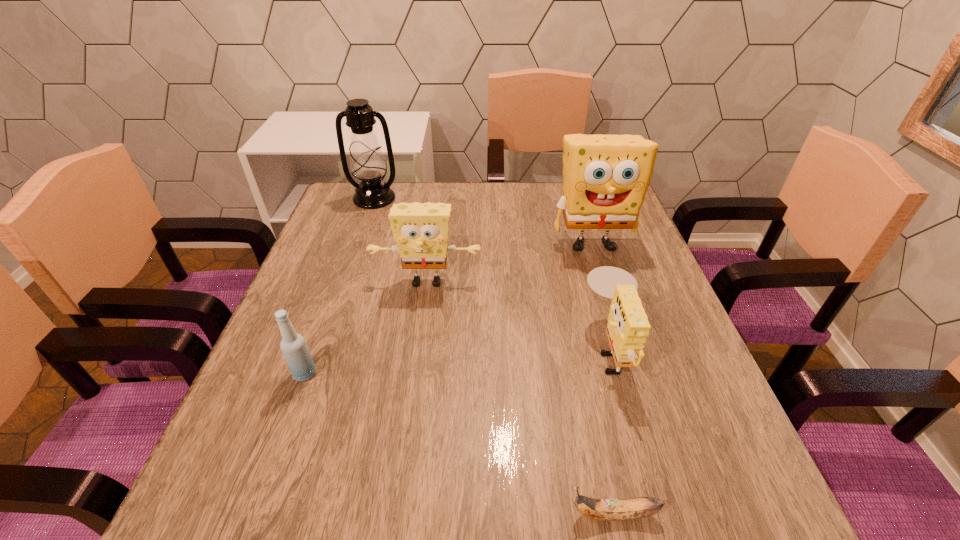
Where is `object at the near edge`? object at the near edge is located at coordinates (598, 509).

Identify the location of oil lamp that is at the left edge. (367, 163).

Locate an element on the screen. bottle that is at the left edge is located at coordinates (293, 345).

The height and width of the screenshot is (540, 960). Find the location of `object that is positioned at the far left corner`. object that is positioned at the far left corner is located at coordinates (367, 163).

Where is `vacant area at the far edge`? The width and height of the screenshot is (960, 540). vacant area at the far edge is located at coordinates (454, 203).

I want to click on vacant space at the near edge of the desktop, so click(x=495, y=521).

This screenshot has width=960, height=540. In the image, there is a desktop. Find the location of `vacant space at the right edge`. vacant space at the right edge is located at coordinates (599, 247).

Where is `free space at the far left corner of the desktop`? free space at the far left corner of the desktop is located at coordinates (334, 211).

The height and width of the screenshot is (540, 960). Find the location of `blank space at the near right corner of the desktop`. blank space at the near right corner of the desktop is located at coordinates (676, 488).

Where is `free space that is in between the shortest sponge and the shortest object`? This screenshot has height=540, width=960. free space that is in between the shortest sponge and the shortest object is located at coordinates (612, 431).